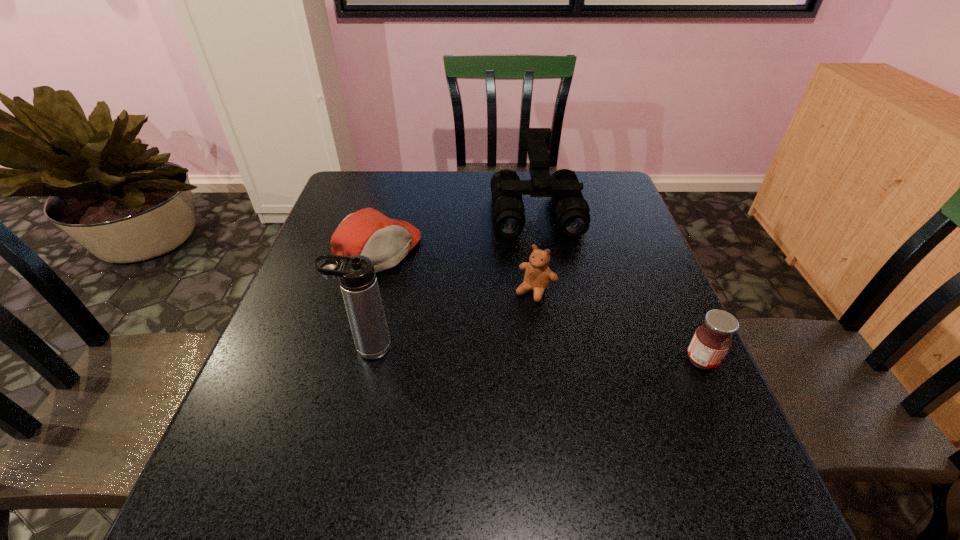
Image resolution: width=960 pixels, height=540 pixels. What are the coordinates of `blank area in the image that satisfies the following two spatial constraints: 1. on the front side of the jam; 2. on the label side of the second tallest object` in the screenshot? It's located at (561, 360).